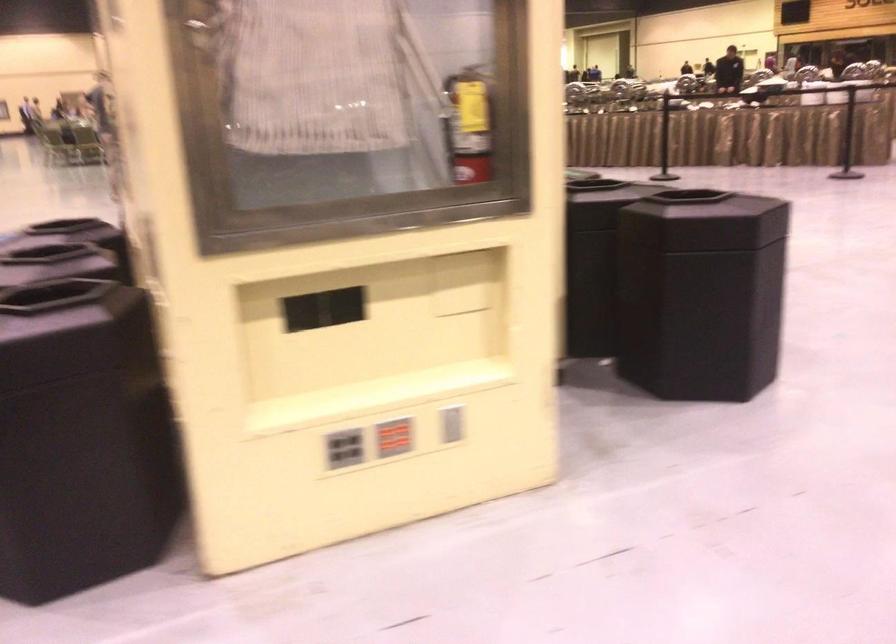
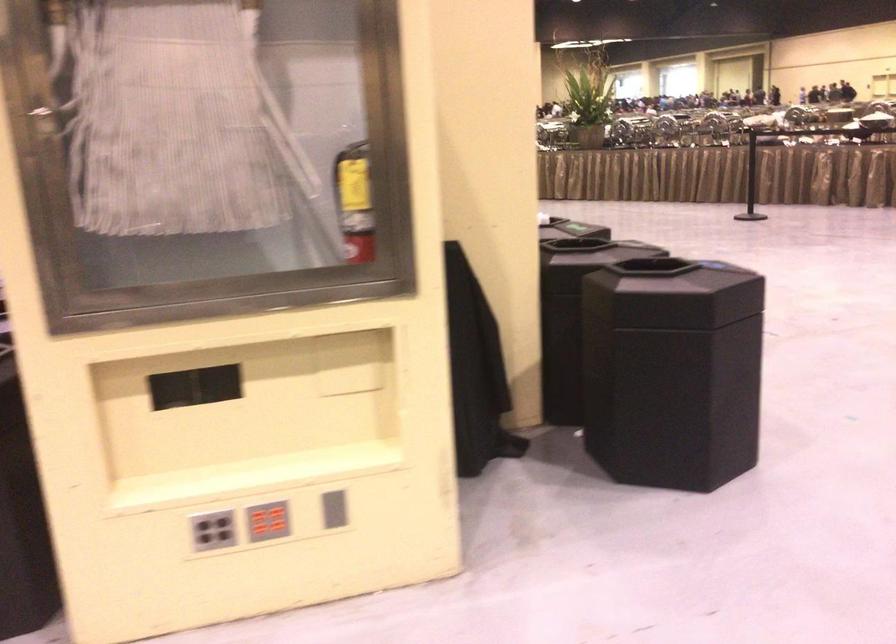
Where in the second image is the point corresponding to (395,436) from the first image?

(268, 521)